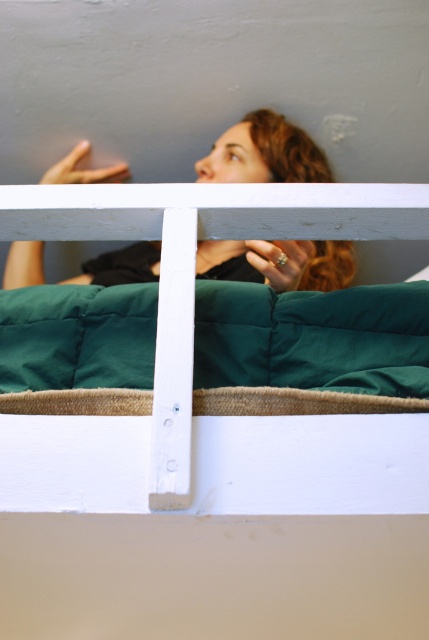
Question: Which point is closer to the camera taking this photo?

Choices:
 (A) (398, 284)
 (B) (341, 275)
 (C) (56, 230)

Answer: (C)

Question: Can you confirm if green down-filled pillow at center is positioned to the left of matte black hair at upper center?

Choices:
 (A) yes
 (B) no

Answer: (B)

Question: Does green down-filled pillow at center lie in front of matte black hair at upper center?

Choices:
 (A) no
 (B) yes

Answer: (A)

Question: Does green down-filled pillow at center have a larger size compared to matte black hair at upper center?

Choices:
 (A) yes
 (B) no

Answer: (B)

Question: Which point is farther from the camera taking this photo?

Choices:
 (A) (353, 426)
 (B) (148, 381)
 (C) (256, 278)

Answer: (C)

Question: Based on their relative distances, which object is farther from the matte black hair at upper center?

Choices:
 (A) green quilted fabric at upper center
 (B) green down-filled pillow at center

Answer: (A)